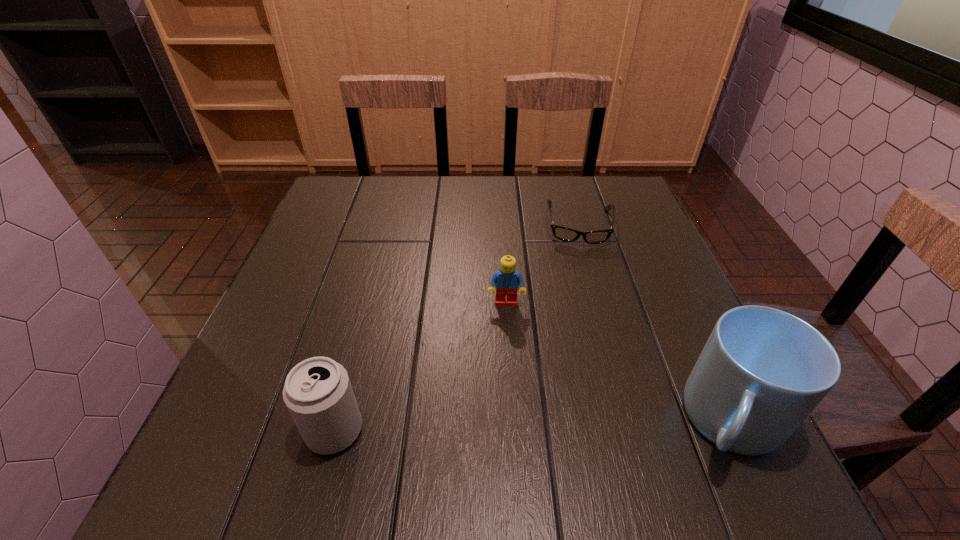
Find the location of `free space on the desktop that is between the second tallest object and the mug and is positioned on the face of the second farthest object`. free space on the desktop that is between the second tallest object and the mug and is positioned on the face of the second farthest object is located at coordinates (510, 427).

The width and height of the screenshot is (960, 540). What are the coordinates of `free space on the desktop that is between the can and the mug and is positioned on the front-facing side of the farthest object` in the screenshot? It's located at (587, 425).